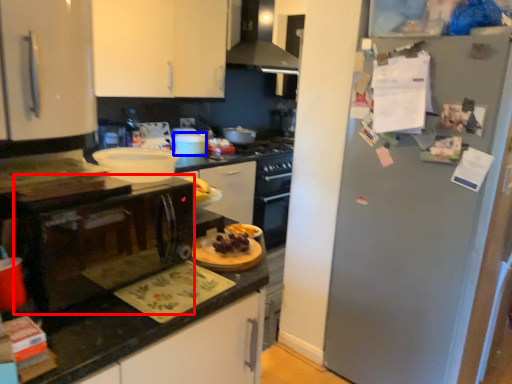
Question: Which of the following is the farthest to the observer, microwave (highlighted by a red box) or appliance (highlighted by a blue box)?

Choices:
 (A) microwave
 (B) appliance

Answer: (B)